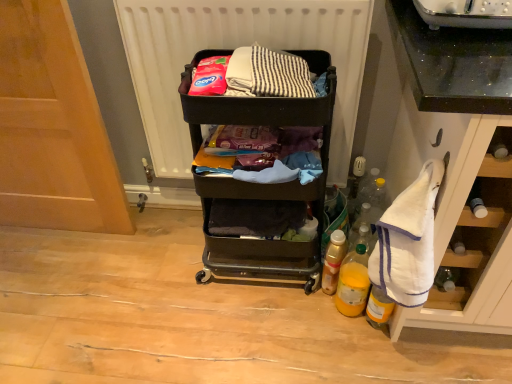
Question: Does yellow matte bottle at lower right, arranged as the second bottle when viewed from the right, have a lesser width compared to translucent plastic bottle at lower right, the third bottle positioned from the right?

Choices:
 (A) no
 (B) yes

Answer: (B)

Question: Does yellow matte bottle at lower right, arranged as the second bottle when viewed from the right, have a lesser height compared to translucent plastic bottle at lower right, the 1th bottle positioned from the left?

Choices:
 (A) yes
 (B) no

Answer: (B)

Question: From a real-world perspective, is yellow matte bottle at lower right, arranged as the second bottle when viewed from the right, positioned under translucent plastic bottle at lower right, the 1th bottle positioned from the left, based on gravity?

Choices:
 (A) no
 (B) yes

Answer: (A)

Question: Is the position of yellow matte bottle at lower right, arranged as the second bottle when viewed from the left, less distant than that of translucent plastic bottle at lower right, the third bottle positioned from the right?

Choices:
 (A) yes
 (B) no

Answer: (A)

Question: Is yellow matte bottle at lower right, arranged as the second bottle when viewed from the right, oriented towards translucent plastic bottle at lower right, the 1th bottle positioned from the left?

Choices:
 (A) yes
 (B) no

Answer: (B)

Question: Considering the relative sizes of yellow matte bottle at lower right, arranged as the second bottle when viewed from the left, and translucent plastic bottle at lower right, the 1th bottle positioned from the left, in the image provided, is yellow matte bottle at lower right, arranged as the second bottle when viewed from the left, bigger than translucent plastic bottle at lower right, the 1th bottle positioned from the left,?

Choices:
 (A) yes
 (B) no

Answer: (A)

Question: Can you confirm if white terry cloth towel at right is positioned to the right of white matte radiator at upper center?

Choices:
 (A) no
 (B) yes

Answer: (B)

Question: Considering the relative sizes of white terry cloth towel at right and white matte radiator at upper center in the image provided, is white terry cloth towel at right smaller than white matte radiator at upper center?

Choices:
 (A) yes
 (B) no

Answer: (A)

Question: Is white terry cloth towel at right outside of white matte radiator at upper center?

Choices:
 (A) no
 (B) yes

Answer: (B)

Question: Is white terry cloth towel at right next to white matte radiator at upper center?

Choices:
 (A) no
 (B) yes

Answer: (A)

Question: From a real-world perspective, is white terry cloth towel at right physically below white matte radiator at upper center?

Choices:
 (A) no
 (B) yes

Answer: (B)

Question: From the image's perspective, is white terry cloth towel at right beneath white matte radiator at upper center?

Choices:
 (A) yes
 (B) no

Answer: (A)

Question: Is black plastic cart at center at the right side of white matte radiator at upper center?

Choices:
 (A) no
 (B) yes

Answer: (B)